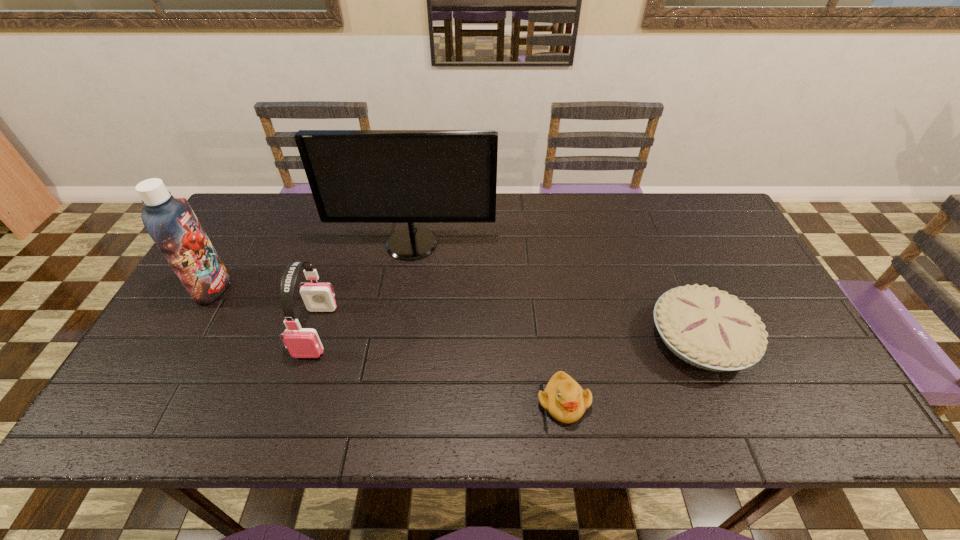
What are the coordinates of `vacant point that satisfies the following two spatial constraints: 1. on the front label of the shampoo; 2. on the left side of the rightmost object` in the screenshot? It's located at (184, 338).

The height and width of the screenshot is (540, 960). Identify the location of vacant space that satisfies the following two spatial constraints: 1. on the back side of the pie; 2. on the front label of the shampoo. (680, 288).

Locate an element on the screen. Image resolution: width=960 pixels, height=540 pixels. free spot that satisfies the following two spatial constraints: 1. on the front-facing side of the pie; 2. on the left side of the computer monitor is located at coordinates (396, 338).

Find the location of `vacant space that satisfies the following two spatial constraints: 1. on the front-facing side of the pie; 2. on the right side of the farthest object`. vacant space that satisfies the following two spatial constraints: 1. on the front-facing side of the pie; 2. on the right side of the farthest object is located at coordinates (396, 338).